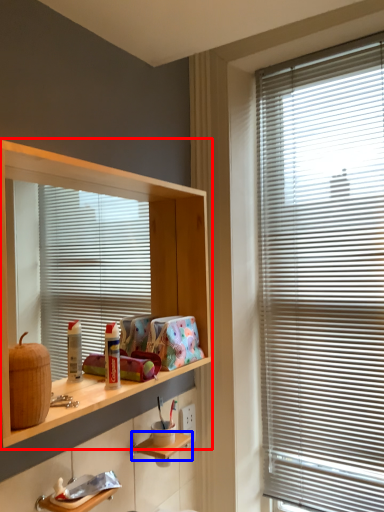
Question: Which of the following is the closest to the observer, shelf (highlighted by a red box) or shelf (highlighted by a blue box)?

Choices:
 (A) shelf
 (B) shelf

Answer: (A)